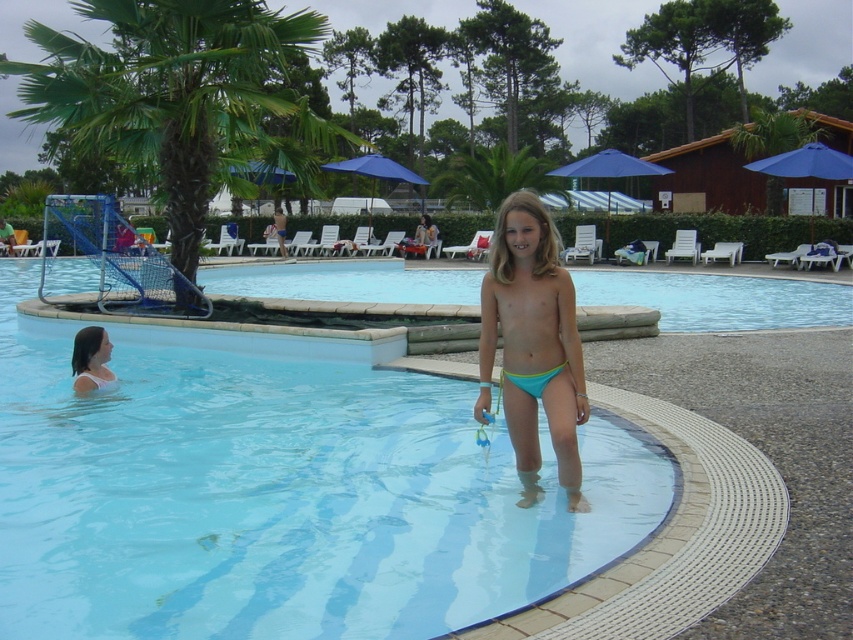
You are a GUI agent. You are given a task and a screenshot of the screen. Output one action in this format:
    pyautogui.click(x=<x>, y=<y>)
    Task: Click on the green leafy palm tree at upper center
    This screenshot has width=853, height=640.
    Given the screenshot: What is the action you would take?
    pyautogui.click(x=492, y=177)

Does point (445, 193) lie in front of point (535, 384)?

No, it is not.

At what (x,y) coordinates should I click in order to perform the action: click on green leafy palm tree at upper center. Please return your answer as a coordinate pair (x, y). This screenshot has width=853, height=640. Looking at the image, I should click on (492, 177).

The height and width of the screenshot is (640, 853). Describe the element at coordinates (279, 497) in the screenshot. I see `clear plastic pool at center` at that location.

Is point (103, 481) positioned after point (134, 156)?

No, (103, 481) is in front of (134, 156).

This screenshot has width=853, height=640. What do you see at coordinates (279, 497) in the screenshot?
I see `clear plastic pool at center` at bounding box center [279, 497].

I want to click on clear plastic pool at center, so click(279, 497).

Between green leafy palm tree at upper center and matte white hair at lower left, which one appears on the left side from the viewer's perspective?

From the viewer's perspective, matte white hair at lower left appears more on the left side.

Describe the element at coordinates (492, 177) in the screenshot. I see `green leafy palm tree at upper center` at that location.

Identify the location of green leafy palm tree at upper center. This screenshot has height=640, width=853. [x=492, y=177].